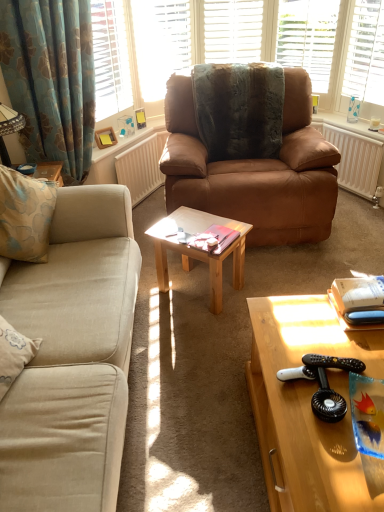
The height and width of the screenshot is (512, 384). Find the location of `free spot above wooden coffee table at lower right, the 2th coffee table viewed from the left (from a real-world perspective)`. free spot above wooden coffee table at lower right, the 2th coffee table viewed from the left (from a real-world perspective) is located at coordinates (328, 374).